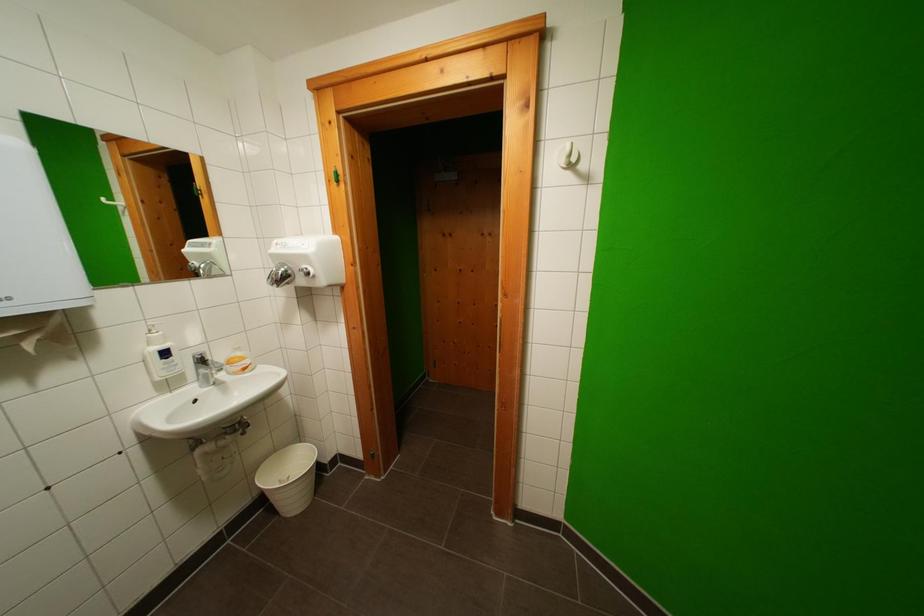
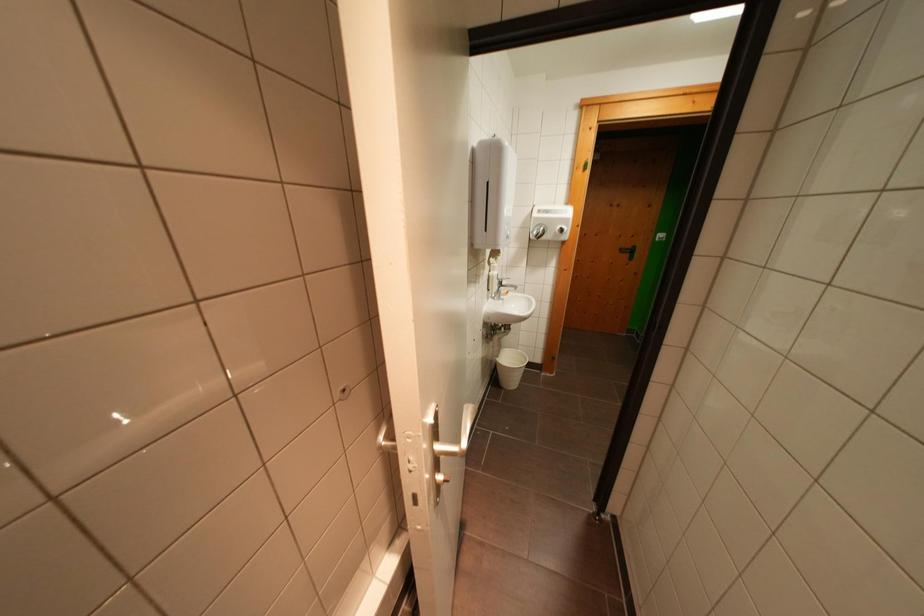
The images are taken continuously from a first-person perspective. In which direction are you moving?

The movement direction of the cameraman is left, backward.